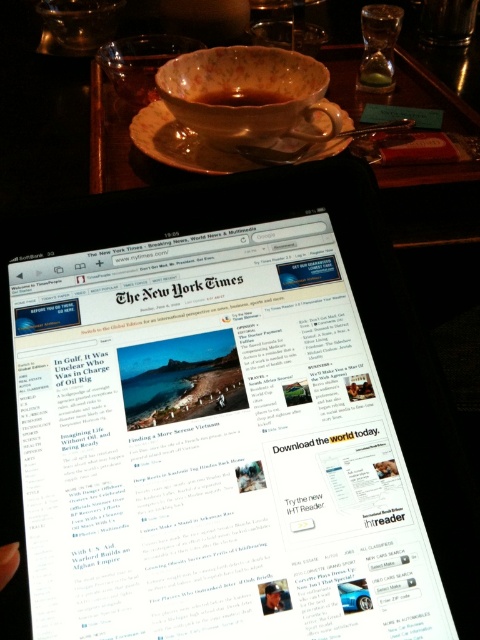
You are a delivery person who just arrived at a house. You see the matte ceramic saucer at upper center on a wooden table. If you want to place a small package on the table without covering the saucer, where should you put it?

The matte ceramic saucer at upper center is 27.26 inches away from the viewer. To place the package without covering it, position it either to the sides or behind the saucer, ensuring there is enough space around it.

You are looking at the tablet screen and see the point marked at (181, 145). What object is located at that point?

The point at (181, 145) corresponds to the matte ceramic saucer at upper center.